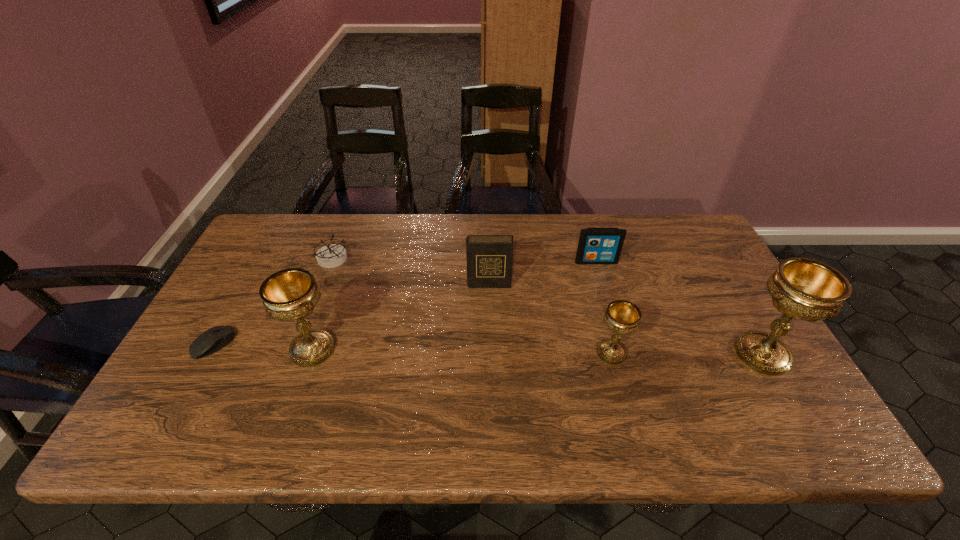
Where is `free space located on the back of the leftmost chalice`? The image size is (960, 540). free space located on the back of the leftmost chalice is located at coordinates (348, 247).

Where is `free region located on the front of the shortest chalice`? The height and width of the screenshot is (540, 960). free region located on the front of the shortest chalice is located at coordinates (625, 402).

Identify the location of vacant region located on the back of the rightmost object. (726, 292).

I want to click on free region located 0.080m on the front screen of the fifth tallest object, so click(x=603, y=282).

Where is `vacant space located on the right of the compass`? This screenshot has width=960, height=540. vacant space located on the right of the compass is located at coordinates (378, 259).

Where is `vacant space located on the front cover of the third farthest object`? vacant space located on the front cover of the third farthest object is located at coordinates (490, 336).

You are a GUI agent. You are given a task and a screenshot of the screen. Output one action in this format:
    pyautogui.click(x=<x>, y=<y>)
    Task: Click on the free space located 0.280m on the right of the computer equipment
    Image resolution: width=960 pixels, height=540 pixels.
    Given the screenshot: What is the action you would take?
    pyautogui.click(x=341, y=345)

Where is `iPod situated at the far edge`? The image size is (960, 540). iPod situated at the far edge is located at coordinates (596, 245).

You are a GUI agent. You are given a task and a screenshot of the screen. Output one action in this format:
    pyautogui.click(x=<x>, y=<y>)
    Task: Click on the compass present at the far edge
    The width and height of the screenshot is (960, 540).
    Given the screenshot: What is the action you would take?
    pyautogui.click(x=330, y=256)

Identify the location of object located in the near edge section of the desktop. This screenshot has width=960, height=540. (806, 289).